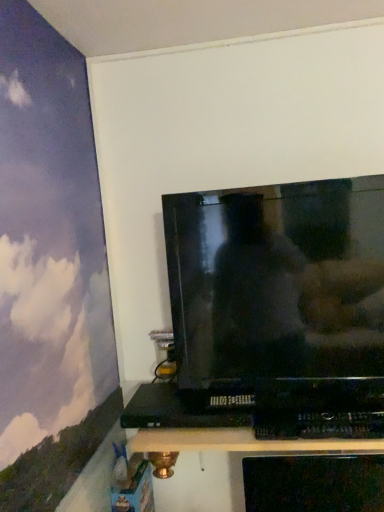
You are a GUI agent. You are given a task and a screenshot of the screen. Output one action in this format:
    pyautogui.click(x=<x>, y=<y>)
    Task: Click on the glossy black tv at upper center
    
    Given the screenshot: What is the action you would take?
    pyautogui.click(x=277, y=282)

You are a GUI agent. You are given a task and a screenshot of the screen. Output one action in this format:
    pyautogui.click(x=<x>, y=<y>)
    Task: Click on the black plastic dvd player at lower center
    
    Given the screenshot: What is the action you would take?
    pyautogui.click(x=174, y=411)

Find the location of a particular element. This screenshot has height=512, width=384. purple matte wall at upper left is located at coordinates (49, 269).

Does point (242, 265) come closer to viewer compared to point (135, 403)?

Yes, it is in front of point (135, 403).

Consider the image. How different are the orientations of glossy black tv at upper center and black plastic dvd player at lower center in degrees?

0.616 degrees.

Can you confirm if glossy black tv at upper center is bigger than black plastic dvd player at lower center?

Correct, glossy black tv at upper center is larger in size than black plastic dvd player at lower center.

From the picture: Based on their positions, is glossy black tv at upper center located to the left or right of black plastic dvd player at lower center?

In the image, glossy black tv at upper center appears on the right side of black plastic dvd player at lower center.

Can you confirm if black plastic shelf at lower center is wider than black plastic dvd player at lower center?

Yes, black plastic shelf at lower center is wider than black plastic dvd player at lower center.

Is black plastic dvd player at lower center completely or partially inside black plastic shelf at lower center?

No, black plastic dvd player at lower center is not a part of black plastic shelf at lower center.

From the image's perspective, who appears lower, black plastic shelf at lower center or black plastic dvd player at lower center?

black plastic shelf at lower center, from the image's perspective.

Which point is more forward, (132, 381) or (86, 199)?

The point (86, 199) is closer to the camera.

What's the angular difference between black plastic shelf at lower center and purple matte wall at upper left's facing directions?

There is a 90.1-degree angle between the facing directions of black plastic shelf at lower center and purple matte wall at upper left.

Would you say black plastic shelf at lower center contains purple matte wall at upper left?

No.

Considering the positions of objects purple matte wall at upper left and glossy black tv at upper center in the image provided, who is more to the left, purple matte wall at upper left or glossy black tv at upper center?

purple matte wall at upper left.

Between purple matte wall at upper left and glossy black tv at upper center, which one has smaller width?

purple matte wall at upper left is thinner.

Consider the image. Considering the sizes of objects purple matte wall at upper left and glossy black tv at upper center in the image provided, who is shorter, purple matte wall at upper left or glossy black tv at upper center?

glossy black tv at upper center is shorter.

Is purple matte wall at upper left closer to camera compared to glossy black tv at upper center?

Yes.

Identify the location of furniture in front of the glossy black tv at upper center. Image resolution: width=384 pixels, height=512 pixels. (218, 463).

From a real-world perspective, between black plastic shelf at lower center and glossy black tv at upper center, who is vertically higher?

glossy black tv at upper center is physically above.

Looking at this image, is black plastic shelf at lower center at the right side of glossy black tv at upper center?

Yes.

Looking at this image, considering the sizes of objects black plastic shelf at lower center and glossy black tv at upper center in the image provided, who is thinner, black plastic shelf at lower center or glossy black tv at upper center?

Thinner between the two is glossy black tv at upper center.

Based on the photo, from a real-world perspective, is black plastic dvd player at lower center positioned above or below glossy black tv at upper center?

Clearly, from a real-world perspective, black plastic dvd player at lower center is below glossy black tv at upper center.

Considering the points (152, 425) and (260, 210), which point is behind, point (152, 425) or point (260, 210)?

The point (260, 210) is farther.

Does black plastic dvd player at lower center have a greater height compared to glossy black tv at upper center?

No.

Based on their positions, is black plastic dvd player at lower center located to the left or right of glossy black tv at upper center?

black plastic dvd player at lower center is positioned on glossy black tv at upper center's left side.

Which is closer to the camera, [206,390] or [25,504]?

Point [25,504]

Considering the positions of objects glossy black tv at upper center and purple matte wall at upper left in the image provided, who is in front, glossy black tv at upper center or purple matte wall at upper left?

purple matte wall at upper left is closer to the camera.

Is glossy black tv at upper center inside or outside of purple matte wall at upper left?

glossy black tv at upper center is not enclosed by purple matte wall at upper left.

Where is `television directly beneath the purple matte wall at upper left (from a real-world perspective)`? This screenshot has width=384, height=512. television directly beneath the purple matte wall at upper left (from a real-world perspective) is located at coordinates (277, 282).

Locate an element on the screen. television that is in front of the black plastic dvd player at lower center is located at coordinates (277, 282).

There is a black plastic shelf at lower center. Where is `computer above it (from a real-world perspective)`? The width and height of the screenshot is (384, 512). computer above it (from a real-world perspective) is located at coordinates (174, 411).

From the image, which object appears to be farther from black plastic dvd player at lower center, glossy black tv at upper center or black plastic shelf at lower center?

Based on the image, black plastic shelf at lower center appears to be further to black plastic dvd player at lower center.

Which object lies nearer to the anchor point purple matte wall at upper left, glossy black tv at upper center or black plastic dvd player at lower center?

Among the two, black plastic dvd player at lower center is located nearer to purple matte wall at upper left.

From the picture: Considering their positions, is purple matte wall at upper left positioned closer to black plastic dvd player at lower center than glossy black tv at upper center?

glossy black tv at upper center.

Estimate the real-world distances between objects in this image. Which object is closer to purple matte wall at upper left, glossy black tv at upper center or black plastic shelf at lower center?

glossy black tv at upper center is positioned closer to the anchor purple matte wall at upper left.

From the picture: From the image, which object appears to be farther from purple matte wall at upper left, black plastic dvd player at lower center or glossy black tv at upper center?

glossy black tv at upper center.

Which object lies further to the anchor point glossy black tv at upper center, black plastic shelf at lower center or purple matte wall at upper left?

The object further to glossy black tv at upper center is black plastic shelf at lower center.

Which object lies nearer to the anchor point black plastic dvd player at lower center, purple matte wall at upper left or black plastic shelf at lower center?

Based on the image, purple matte wall at upper left appears to be nearer to black plastic dvd player at lower center.

From the image, which object appears to be nearer to black plastic shelf at lower center, black plastic dvd player at lower center or glossy black tv at upper center?

Among the two, black plastic dvd player at lower center is located nearer to black plastic shelf at lower center.

Where is `computer between purple matte wall at upper left and glossy black tv at upper center in the horizontal direction`? The width and height of the screenshot is (384, 512). computer between purple matte wall at upper left and glossy black tv at upper center in the horizontal direction is located at coordinates (174, 411).

I want to click on computer located between purple matte wall at upper left and black plastic shelf at lower center in the left-right direction, so click(174, 411).

Identify the location of computer between glossy black tv at upper center and black plastic shelf at lower center vertically. (174, 411).

Image resolution: width=384 pixels, height=512 pixels. In order to click on television between purple matte wall at upper left and black plastic shelf at lower center from left to right in this screenshot , I will do `click(277, 282)`.